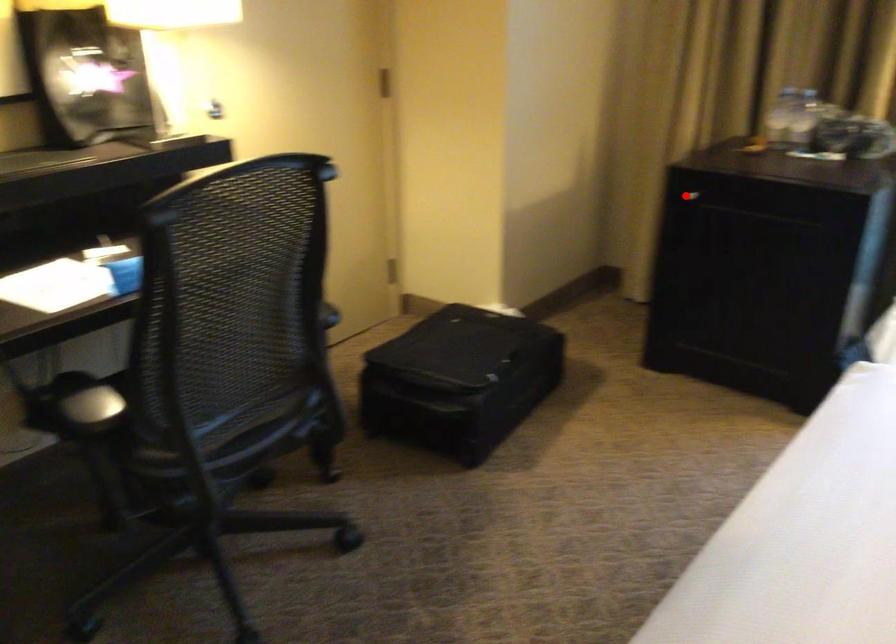
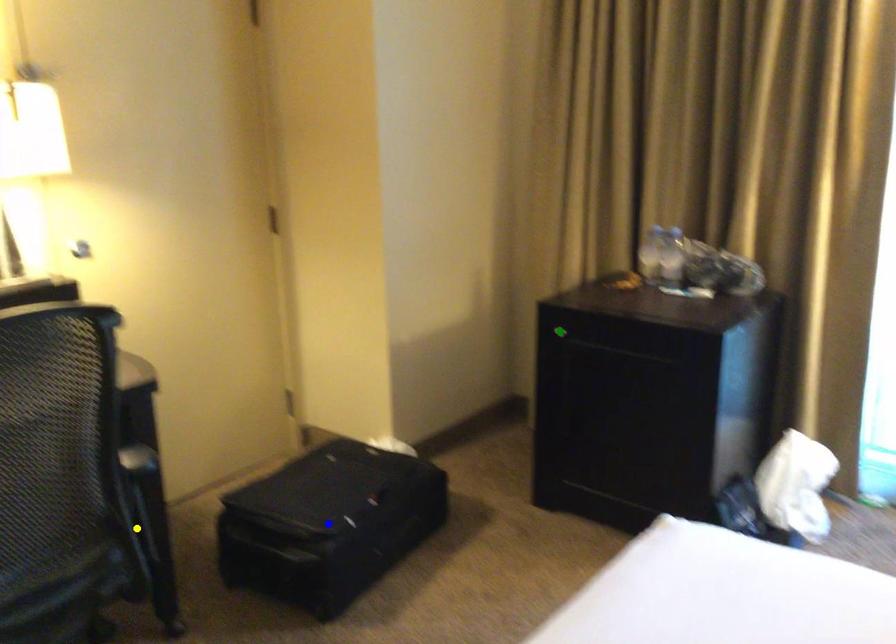
Question: I am providing you with two images of the same scene from different viewpoints. A red point is marked on the first image. You are given multiple points on the second image. Which point in image 2 is actually the same real-world point as the red point in image 1?

Choices:
 (A) yellow point
 (B) blue point
 (C) green point

Answer: (C)